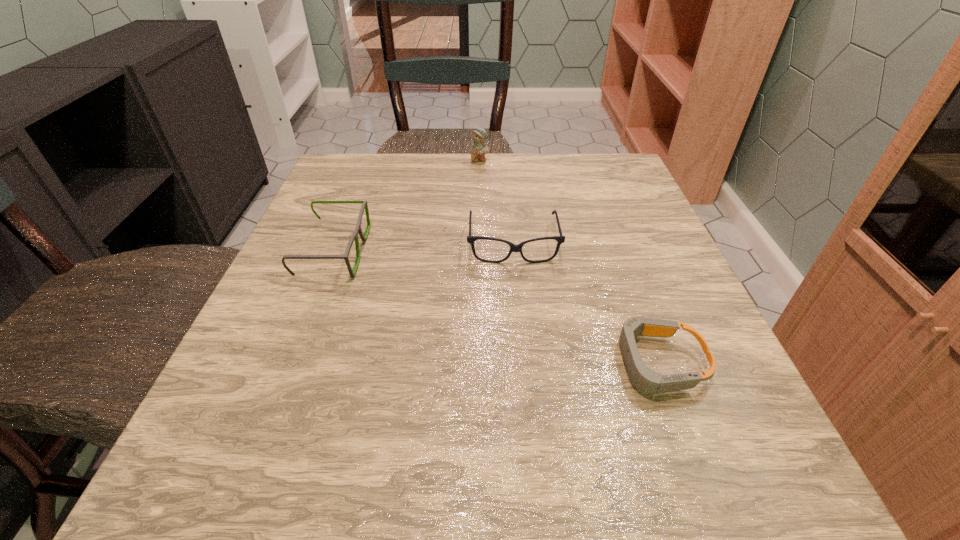
Identify the location of vacant space that is in between the leftmost object and the goggles. The height and width of the screenshot is (540, 960). (495, 307).

This screenshot has height=540, width=960. In order to click on vacant space that's between the right spectacles and the left spectacles in this screenshot , I will do `click(423, 248)`.

Select which object is the second closest to the right spectacles. Please provide its 2D coordinates. Your answer should be formatted as a tuple, i.e. [(x, y)], where the tuple contains the x and y coordinates of a point satisfying the conditions above.

[(358, 229)]

Select which object appears as the second closest to the goggles. Please provide its 2D coordinates. Your answer should be formatted as a tuple, i.e. [(x, y)], where the tuple contains the x and y coordinates of a point satisfying the conditions above.

[(358, 229)]

This screenshot has height=540, width=960. I want to click on vacant region that satisfies the following two spatial constraints: 1. on the front-facing side of the right spectacles; 2. on the lens of the leftmost object, so click(x=514, y=252).

You are a GUI agent. You are given a task and a screenshot of the screen. Output one action in this format:
    pyautogui.click(x=<x>, y=<y>)
    Task: Click on the free space that satisfies the following two spatial constraints: 1. on the front-facing side of the teddy bear; 2. on the lens of the left spectacles
    Image resolution: width=960 pixels, height=540 pixels.
    Given the screenshot: What is the action you would take?
    pyautogui.click(x=480, y=252)